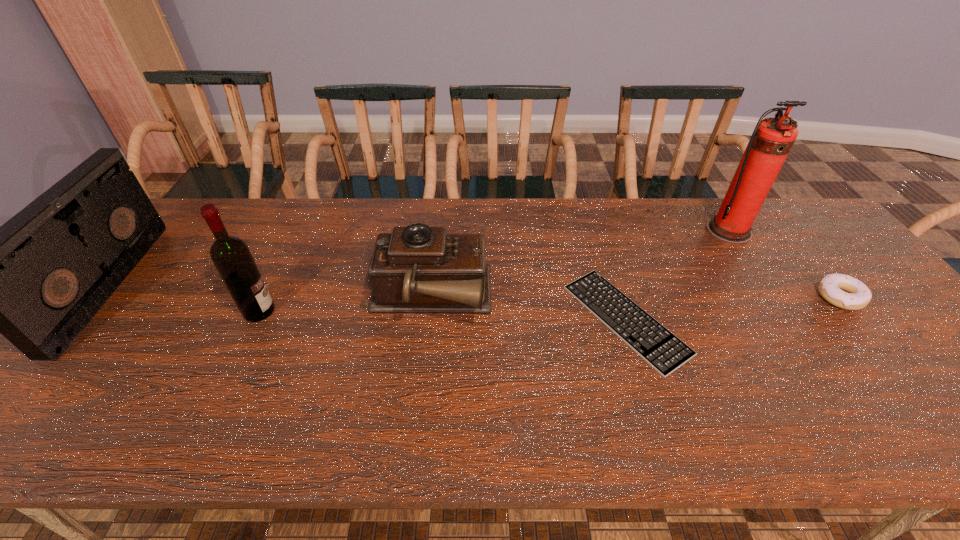
Where is `object located in the right edge section of the desktop`? The image size is (960, 540). object located in the right edge section of the desktop is located at coordinates (846, 292).

Where is `object situated at the far left corner`? This screenshot has height=540, width=960. object situated at the far left corner is located at coordinates (39, 279).

Find the location of `blank space at the far edge`. blank space at the far edge is located at coordinates (660, 232).

Where is `free space at the near edge of the desktop`? The width and height of the screenshot is (960, 540). free space at the near edge of the desktop is located at coordinates (773, 415).

You are a GUI agent. You are given a task and a screenshot of the screen. Output one action in this format:
    pyautogui.click(x=<x>, y=<y>)
    Task: Click on the vacant area at the left edge
    The height and width of the screenshot is (540, 960).
    Given the screenshot: What is the action you would take?
    pyautogui.click(x=141, y=280)

Where is `free space at the right edge of the desktop`? Image resolution: width=960 pixels, height=540 pixels. free space at the right edge of the desktop is located at coordinates (925, 399).

Where is `vacant space at the far left corner of the desktop`? The height and width of the screenshot is (540, 960). vacant space at the far left corner of the desktop is located at coordinates (172, 241).

You are a GUI agent. You are given a task and a screenshot of the screen. Output one action in this format:
    pyautogui.click(x=<x>, y=<y>)
    Task: Click on the free location at the far right corner of the desktop
    This screenshot has height=540, width=960.
    Given the screenshot: What is the action you would take?
    pyautogui.click(x=826, y=234)

What are the coordinates of `free spot between the second object from left to right and the third object from right to left` in the screenshot? It's located at (443, 315).

Find the location of a particular element. This screenshot has width=960, height=540. vacant area between the second object from right to left and the computer keyboard is located at coordinates click(x=677, y=275).